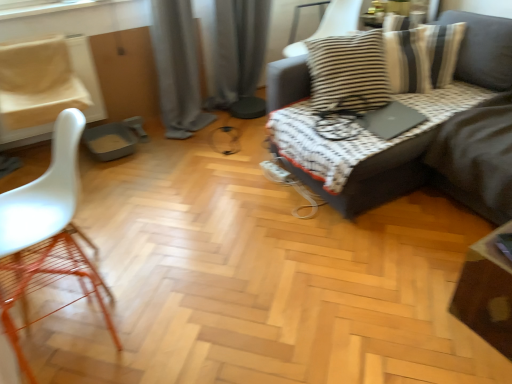
Question: From the image's perspective, does white plastic chair at left, the 3th chair positioned from the right, appear higher than white matte chair at left, positioned as the third chair in back-to-front order?

Choices:
 (A) no
 (B) yes

Answer: (B)

Question: Can you confirm if white plastic chair at left, the second chair viewed from the top, is wider than white matte chair at left, the first chair positioned from the front?

Choices:
 (A) yes
 (B) no

Answer: (A)

Question: Can you confirm if white plastic chair at left, the 3th chair positioned from the right, is thinner than white matte chair at left, marked as the 2th chair in a right-to-left arrangement?

Choices:
 (A) yes
 (B) no

Answer: (B)

Question: Does white plastic chair at left, the second chair viewed from the top, have a larger size compared to white matte chair at left, acting as the first chair starting from the bottom?

Choices:
 (A) no
 (B) yes

Answer: (A)

Question: Does white plastic chair at left, the second chair viewed from the top, contain white matte chair at left, positioned as the third chair in back-to-front order?

Choices:
 (A) yes
 (B) no

Answer: (B)

Question: Considering the positions of dark gray fabric couch at upper right and wooden table at lower right in the image, is dark gray fabric couch at upper right bigger or smaller than wooden table at lower right?

Choices:
 (A) big
 (B) small

Answer: (A)

Question: Is dark gray fabric couch at upper right to the left or to the right of wooden table at lower right in the image?

Choices:
 (A) right
 (B) left

Answer: (B)

Question: From the image's perspective, relative to wooden table at lower right, is dark gray fabric couch at upper right above or below?

Choices:
 (A) above
 (B) below

Answer: (A)

Question: Would you say dark gray fabric couch at upper right is inside or outside wooden table at lower right?

Choices:
 (A) outside
 (B) inside

Answer: (A)

Question: Relative to wooden table at lower right, is white plastic chair at left, which is counted as the second chair, starting from the bottom, in front or behind?

Choices:
 (A) behind
 (B) front

Answer: (A)

Question: Based on their sizes in the image, would you say white plastic chair at left, the 3th chair positioned from the right, is bigger or smaller than wooden table at lower right?

Choices:
 (A) small
 (B) big

Answer: (B)

Question: Do you think white plastic chair at left, positioned as the 2th chair in back-to-front order, is within wooden table at lower right, or outside of it?

Choices:
 (A) outside
 (B) inside

Answer: (A)

Question: From the image's perspective, is white plastic chair at left, the 3th chair positioned from the right, positioned above or below wooden table at lower right?

Choices:
 (A) above
 (B) below

Answer: (A)

Question: From a real-world perspective, is gray fabric curtain at center, the first curtain when ordered from left to right, positioned above or below white matte chair at left, which is the third chair in top-to-bottom order?

Choices:
 (A) above
 (B) below

Answer: (A)

Question: Does point (163, 0) appear closer or farther from the camera than point (12, 297)?

Choices:
 (A) farther
 (B) closer

Answer: (A)